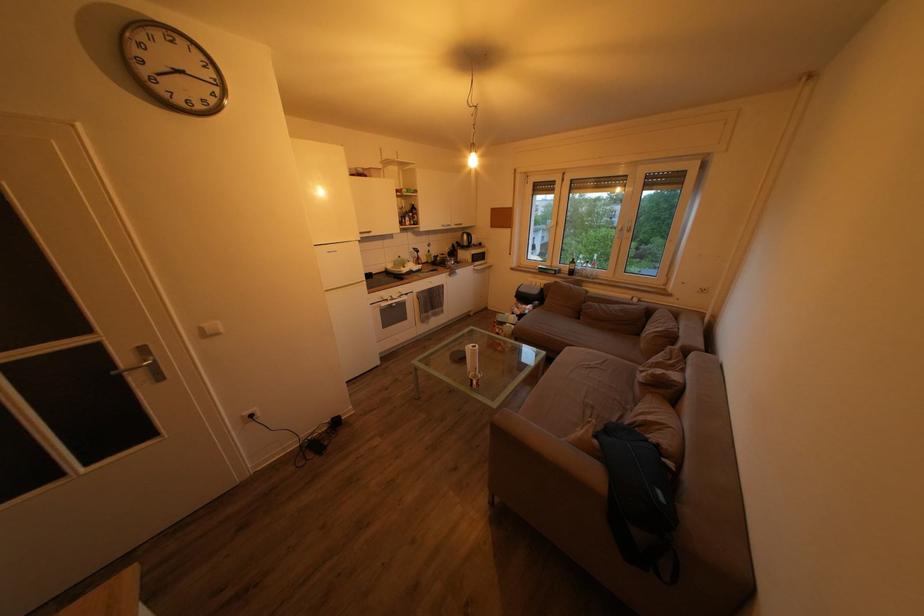
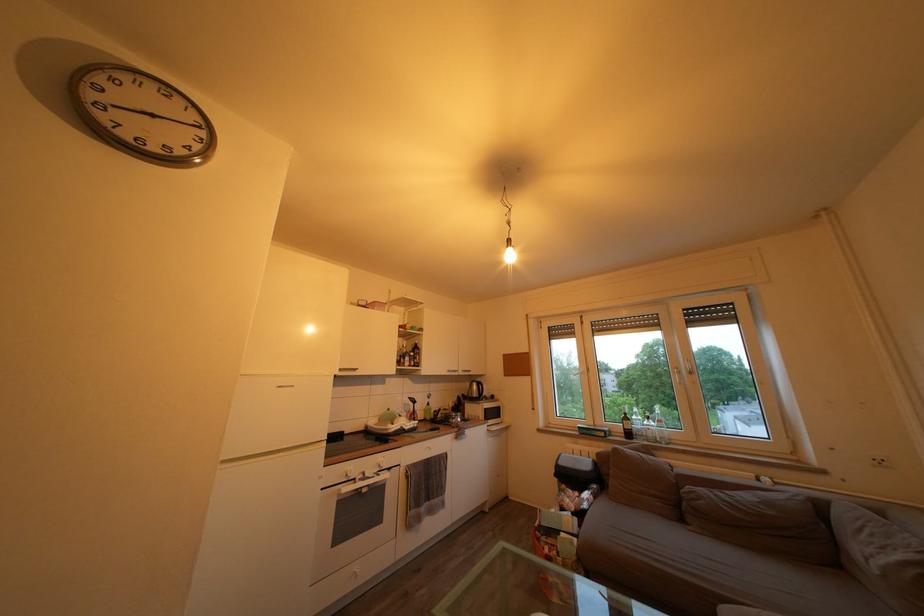
Find the pixel in the second image that matches (x=220, y=107) in the first image.

(188, 158)